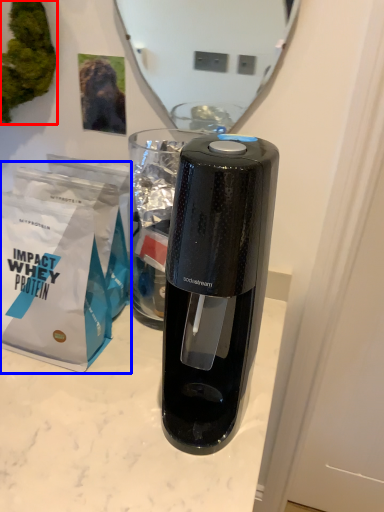
Question: Which point is closer to the camera, plant (highlighted by a red box) or paper bag (highlighted by a blue box)?

Choices:
 (A) plant
 (B) paper bag

Answer: (B)